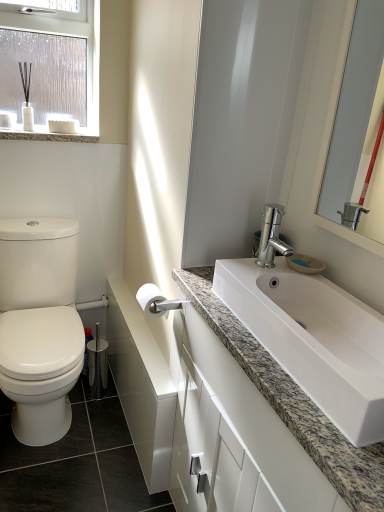
Find the location of a particular element. The height and width of the screenshot is (512, 384). vacant area on top of white glossy cabinet at lower center (from a real-world perspective) is located at coordinates (139, 332).